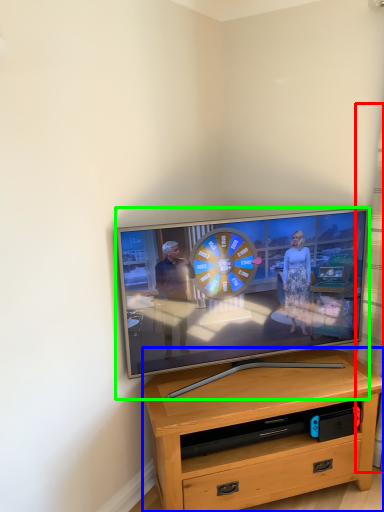
Question: Which object is the closest to the curtain (highlighted by a red box)? Choose among these: desk (highlighted by a blue box) or television (highlighted by a green box).

Choices:
 (A) desk
 (B) television

Answer: (B)